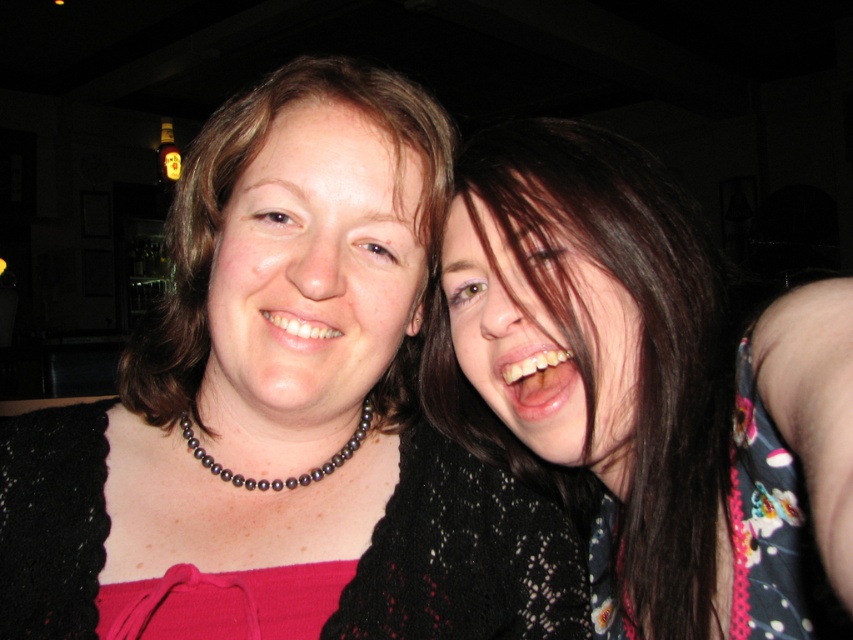
You are standing in a dimly lit bar and want to place a small decoration exactly at the point marked as point (584, 480). If your hand is currently 50 centimeters away from the point, how much closer do you need to move your hand to reach the point?

The distance of point (584, 480) from viewer is 69.55 centimeters. Since your hand is currently 50 centimeters away, you need to move your hand closer by 19.55 centimeters to reach the point.

You are taking a photo of two people in a dimly lit bar. You notice the dark brown hair at upper right and the floral fabric dress at right. Which object is covering part of the other?

The dark brown hair at upper right is positioned over the floral fabric dress at right, so it is covering part of it.